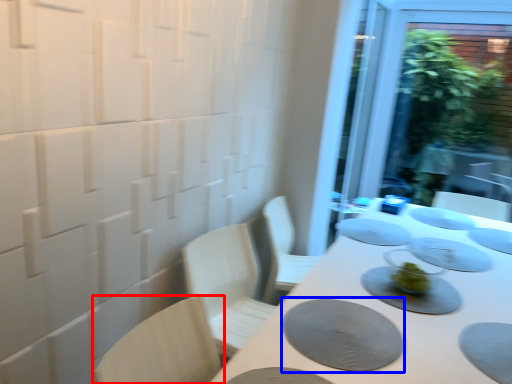
Question: Which point is further to the camera, chair (highlighted by a red box) or platter (highlighted by a blue box)?

Choices:
 (A) chair
 (B) platter

Answer: (B)